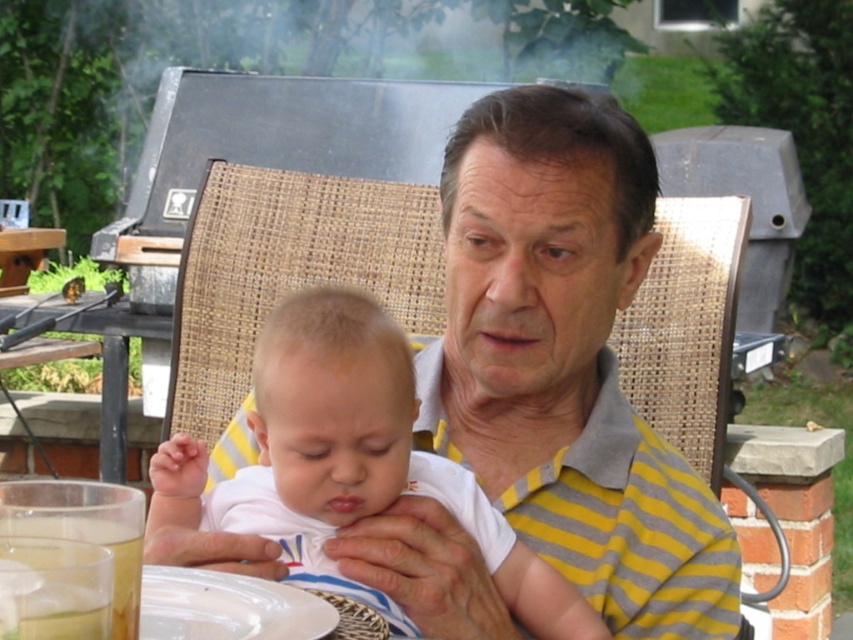
Who is higher up, white cotton baby at center or white matte plate at lower center?

Positioned higher is white cotton baby at center.

Does white cotton baby at center have a greater width compared to white matte plate at lower center?

Yes.

The width and height of the screenshot is (853, 640). What do you see at coordinates (347, 461) in the screenshot?
I see `white cotton baby at center` at bounding box center [347, 461].

This screenshot has height=640, width=853. Identify the location of white cotton baby at center. (347, 461).

Is point (473, 252) closer to camera compared to point (375, 394)?

No, (473, 252) is behind (375, 394).

Is the position of yellow striped polo shirt at center more distant than that of white cotton baby at center?

That is True.

Between point (572, 429) and point (415, 404), which one is positioned behind?

The point (572, 429) is more distant.

This screenshot has height=640, width=853. In order to click on yellow striped polo shirt at center in this screenshot , I will do `click(566, 362)`.

Is yellow striped polo shirt at center taller than white matte plate at lower center?

Indeed, yellow striped polo shirt at center has a greater height compared to white matte plate at lower center.

In the scene shown: Is yellow striped polo shirt at center wider than white matte plate at lower center?

Yes, yellow striped polo shirt at center is wider than white matte plate at lower center.

Who is more distant from viewer, (x=552, y=362) or (x=265, y=589)?

The point (x=552, y=362) is behind.

This screenshot has height=640, width=853. What are the coordinates of `yellow striped polo shirt at center` in the screenshot? It's located at (566, 362).